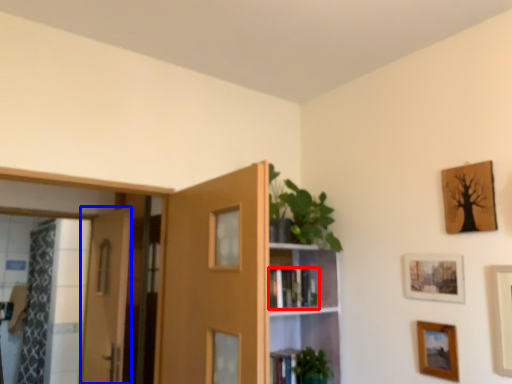
Question: Which point is closer to the camera, book (highlighted by a red box) or door (highlighted by a blue box)?

Choices:
 (A) book
 (B) door

Answer: (A)